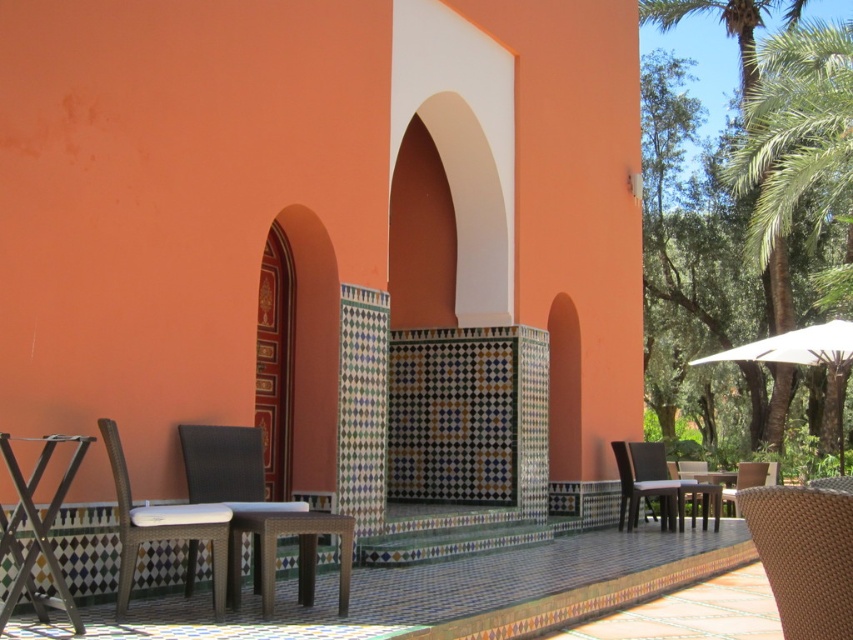
You are standing on the patio and want to move from the building wall to the green leafy palm tree at right. Which object would you pass first, the matte wicker chair at lower left or the palm tree?

You would pass the matte wicker chair at lower left first because it is closer to the viewer than the green leafy palm tree at right.

You are sitting at the small square table on the patio and want to know if the green leafy palm tree at right is casting shade over the white fabric umbrella at right. Based on their positions, can you determine if the palm tree is above the umbrella?

The green leafy palm tree at right is above the white fabric umbrella at right, so yes, the palm tree is positioned above the umbrella and likely casting shade over it.

You are standing on the patio and want to move from one point to another. Which point, point (221, 538) or point (786, 250), is closer to you?

Point (221, 538) is closer to the viewer than point (786, 250).